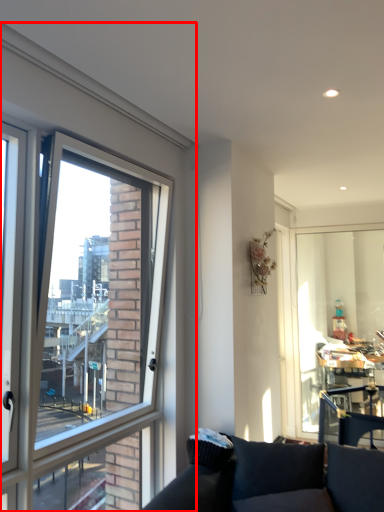
Question: Where is window (annotated by the red box) located in relation to window screen in the image?

Choices:
 (A) left
 (B) right

Answer: (A)